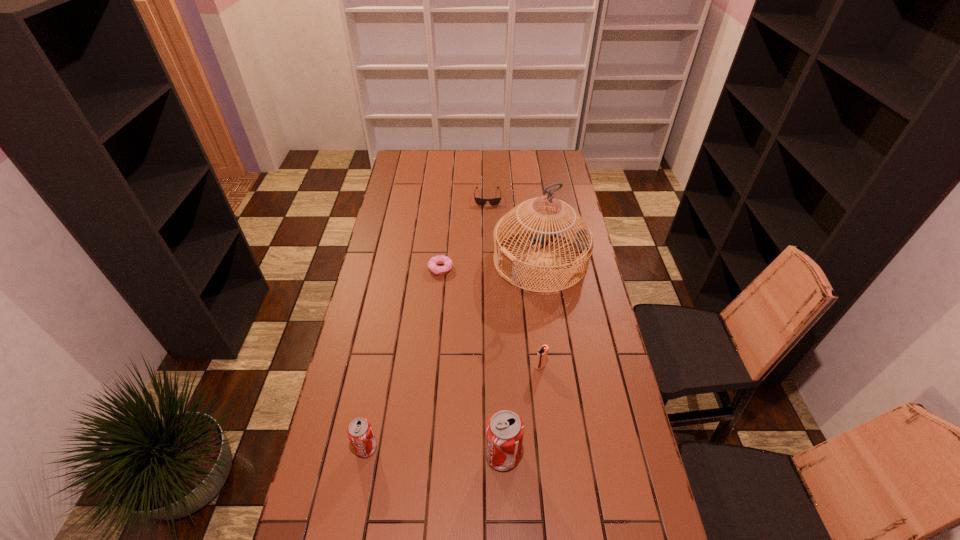
Image resolution: width=960 pixels, height=540 pixels. I want to click on free spot between the sunglasses and the doughnut, so click(464, 233).

I want to click on unoccupied position between the third tallest object and the right soda can, so click(x=435, y=451).

The height and width of the screenshot is (540, 960). I want to click on free spot between the second object from left to right and the shorter soda can, so click(403, 358).

Where is `free space between the fifth object from right to left and the right soda can`? free space between the fifth object from right to left and the right soda can is located at coordinates (471, 362).

Identify which object is the fourth nearest to the igniter. Please provide its 2D coordinates. Your answer should be formatted as a tuple, i.e. [(x, y)], where the tuple contains the x and y coordinates of a point satisfying the conditions above.

[(360, 433)]

Choose which object is the nearest neighbor to the igniter. Please provide its 2D coordinates. Your answer should be formatted as a tuple, i.e. [(x, y)], where the tuple contains the x and y coordinates of a point satisfying the conditions above.

[(504, 431)]

The width and height of the screenshot is (960, 540). Find the location of `vacant space that satisfies the following two spatial constraints: 1. on the front-facing side of the taller soda can; 2. on the left side of the sunglasses`. vacant space that satisfies the following two spatial constraints: 1. on the front-facing side of the taller soda can; 2. on the left side of the sunglasses is located at coordinates (492, 455).

You are a GUI agent. You are given a task and a screenshot of the screen. Output one action in this format:
    pyautogui.click(x=<x>, y=<y>)
    Task: Click on the vacant space that satisfies the following two spatial constraints: 1. on the front-facing side of the right soda can; 2. on the right side of the sunglasses
    The image size is (960, 540).
    Given the screenshot: What is the action you would take?
    pyautogui.click(x=492, y=455)

Where is `vacant position in the image that satisfies the following two spatial constraints: 1. on the back side of the birdcage; 2. on the right side of the third tallest object`? Image resolution: width=960 pixels, height=540 pixels. vacant position in the image that satisfies the following two spatial constraints: 1. on the back side of the birdcage; 2. on the right side of the third tallest object is located at coordinates (401, 260).

In order to click on free spot that satisfies the following two spatial constraints: 1. on the front-facing side of the sunglasses; 2. on the left side of the fourth farthest object in this screenshot , I will do `click(492, 367)`.